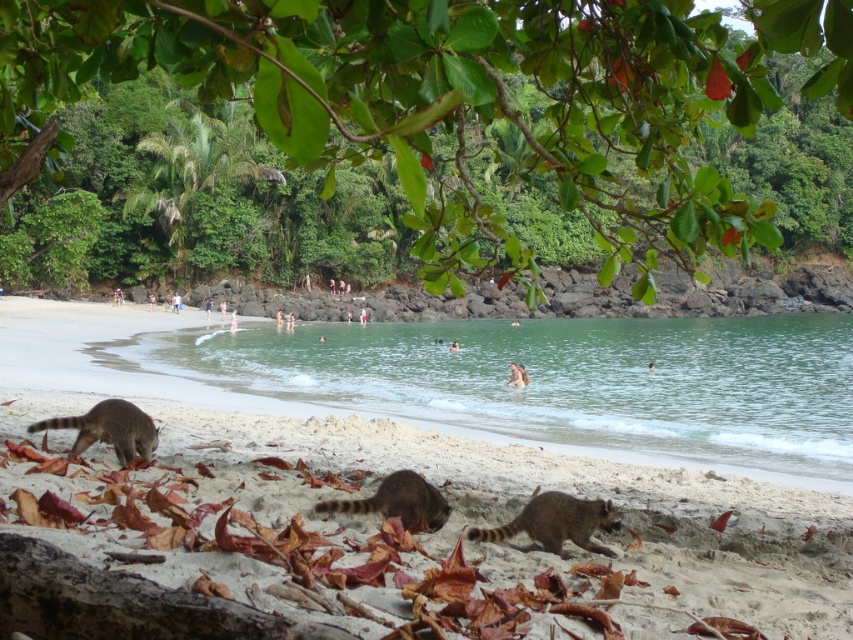
How much distance is there between clear water at beach center and brown fur raccoon at lower center?

clear water at beach center is 22.13 meters away from brown fur raccoon at lower center.

Which is more to the right, clear water at beach center or brown fur raccoon at lower center?

clear water at beach center

Describe the element at coordinates (558, 380) in the screenshot. I see `clear water at beach center` at that location.

Find the location of a particular element. clear water at beach center is located at coordinates (558, 380).

Where is `clear water at beach center`? The width and height of the screenshot is (853, 640). clear water at beach center is located at coordinates (558, 380).

Does clear water at beach center have a greater height compared to brown fur raccoon at lower left?

Indeed, clear water at beach center has a greater height compared to brown fur raccoon at lower left.

Identify the location of clear water at beach center. This screenshot has height=640, width=853. (558, 380).

Where is `brown fur raccoon at lower center`? This screenshot has width=853, height=640. brown fur raccoon at lower center is located at coordinates (556, 522).

Is brown fur raccoon at lower center above brown fur raccoon at lower left?

Incorrect, brown fur raccoon at lower center is not positioned above brown fur raccoon at lower left.

This screenshot has height=640, width=853. I want to click on brown fur raccoon at lower center, so click(x=556, y=522).